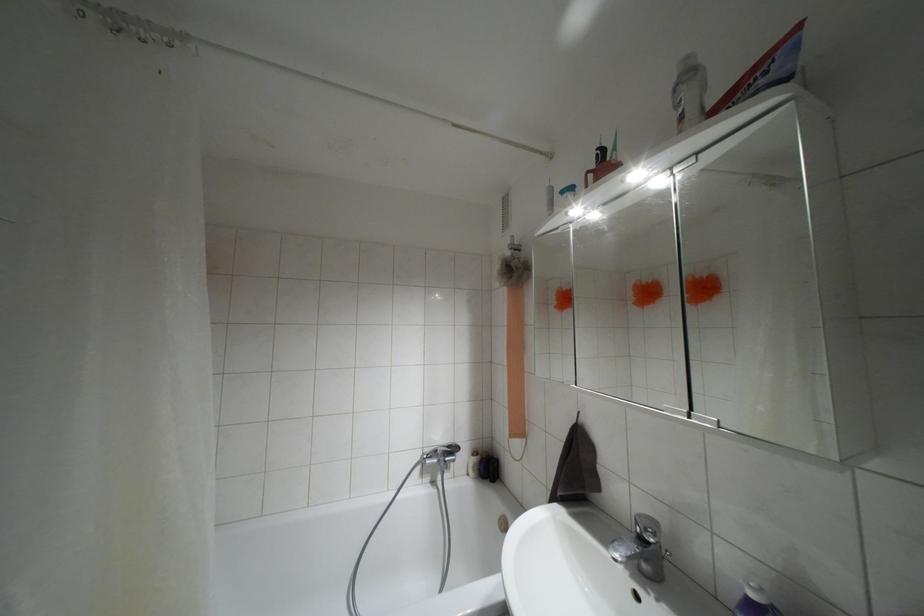
The location [755,599] corresponds to which object?

It corresponds to the blue spray bottle in the image.